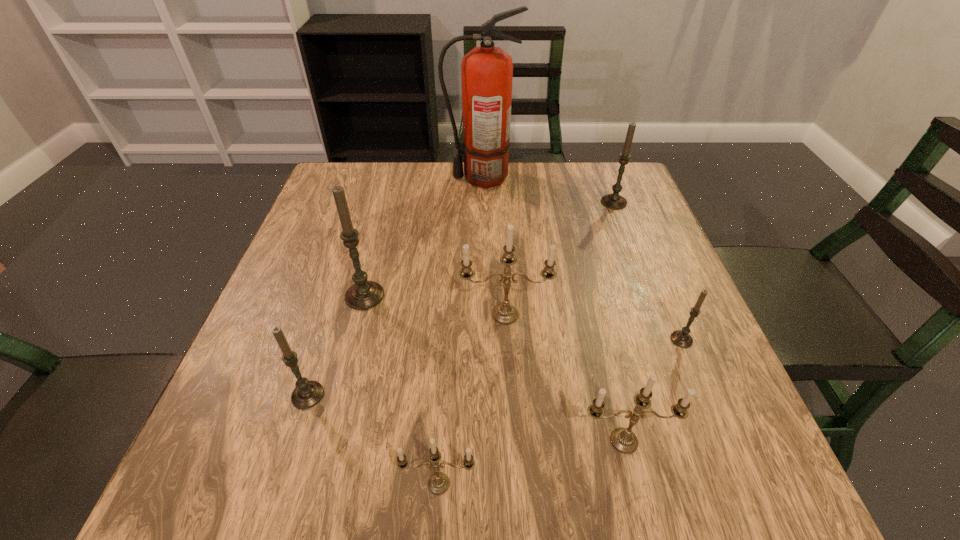
Identify the location of free space located on the right of the farthest metallic candle. This screenshot has height=540, width=960. (630, 314).

This screenshot has width=960, height=540. I want to click on blank space located 0.070m on the left of the third biggest gray candle, so click(252, 395).

Locate an element on the screen. The height and width of the screenshot is (540, 960). vacant region located 0.330m on the left of the second nearest candle is located at coordinates (371, 441).

Locate an element on the screen. free space located 0.050m on the front of the fourth nearest object is located at coordinates (694, 370).

I want to click on free space located 0.290m on the right of the nearest candle, so coord(672,483).

You are a GUI agent. You are given a task and a screenshot of the screen. Output one action in this format:
    pyautogui.click(x=<x>, y=<y>)
    Task: Click on the fire extinguisher located in the far edge section of the desktop
    
    Given the screenshot: What is the action you would take?
    pyautogui.click(x=487, y=72)

At what (x,y) coordinates should I click in order to perform the action: click on candle that is at the far edge. Please return your answer as a coordinate pair (x, y). Looking at the image, I should click on (615, 201).

Where is `object at the far right corner`? object at the far right corner is located at coordinates (615, 201).

Identify the location of object that is at the near right corner. (622, 439).

In the image, there is a desktop. Where is `vacant space at the far edge`? Image resolution: width=960 pixels, height=540 pixels. vacant space at the far edge is located at coordinates (383, 202).